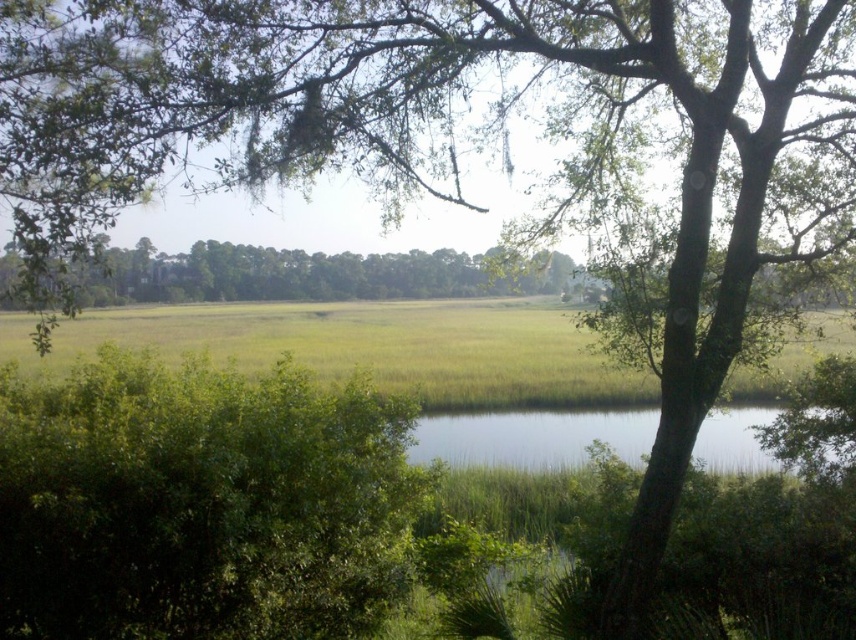
Question: Is green leafy bush at center positioned behind green leafy tree at center?

Choices:
 (A) yes
 (B) no

Answer: (A)

Question: Considering the relative positions of green leafy bush at center and green leafy tree at center in the image provided, where is green leafy bush at center located with respect to green leafy tree at center?

Choices:
 (A) below
 (B) above

Answer: (A)

Question: Based on their relative distances, which object is farther from the green leafy tree at center?

Choices:
 (A) green grassy field at center
 (B) clear water at center
 (C) green leafy bush at center

Answer: (C)

Question: Which object appears closest to the camera in this image?

Choices:
 (A) green grassy field at center
 (B) green leafy bush at center

Answer: (B)

Question: Does green grassy field at center lie behind green leafy tree at center?

Choices:
 (A) no
 (B) yes

Answer: (B)

Question: Which object appears farthest from the camera in this image?

Choices:
 (A) green leafy bush at center
 (B) green leafy tree at center
 (C) green grassy field at center
 (D) clear water at center

Answer: (C)